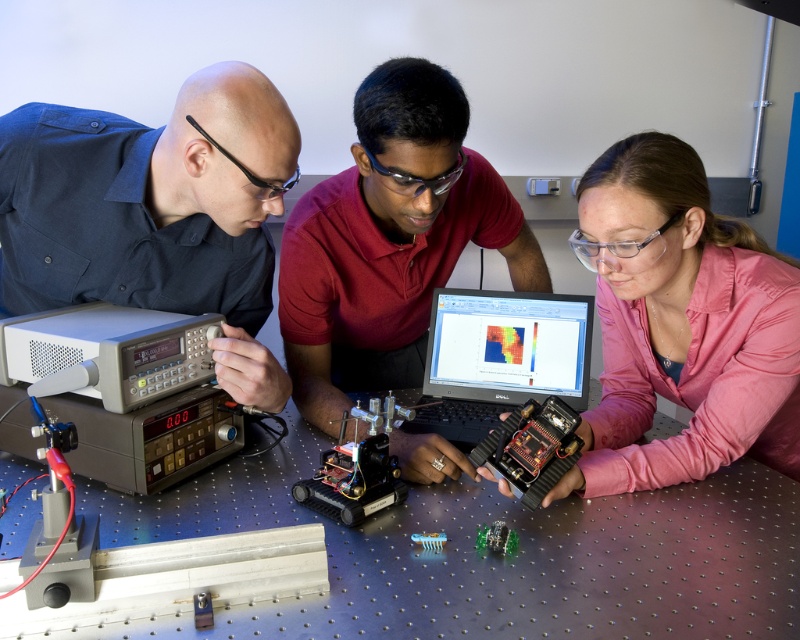
Question: Which object appears farthest from the camera in this image?

Choices:
 (A) matte black shirt at left
 (B) black plastic circuit board at center

Answer: (B)

Question: Which of the following is the farthest from the observer?

Choices:
 (A) pink fabric shirt at center
 (B) gray plastic electronic device at left

Answer: (A)

Question: Which is farther from the metallic circuit board at center?

Choices:
 (A) matte black shirt at left
 (B) metallic silver table at center
 (C) black plastic circuit board at center
 (D) black plastic laptop at center

Answer: (A)

Question: Is metallic silver table at center positioned before matte black shirt at left?

Choices:
 (A) yes
 (B) no

Answer: (A)

Question: Is matte red shirt at center positioned behind metallic circuit board at center?

Choices:
 (A) yes
 (B) no

Answer: (B)

Question: Does pink fabric shirt at center have a smaller size compared to gray plastic electronic device at left?

Choices:
 (A) no
 (B) yes

Answer: (A)